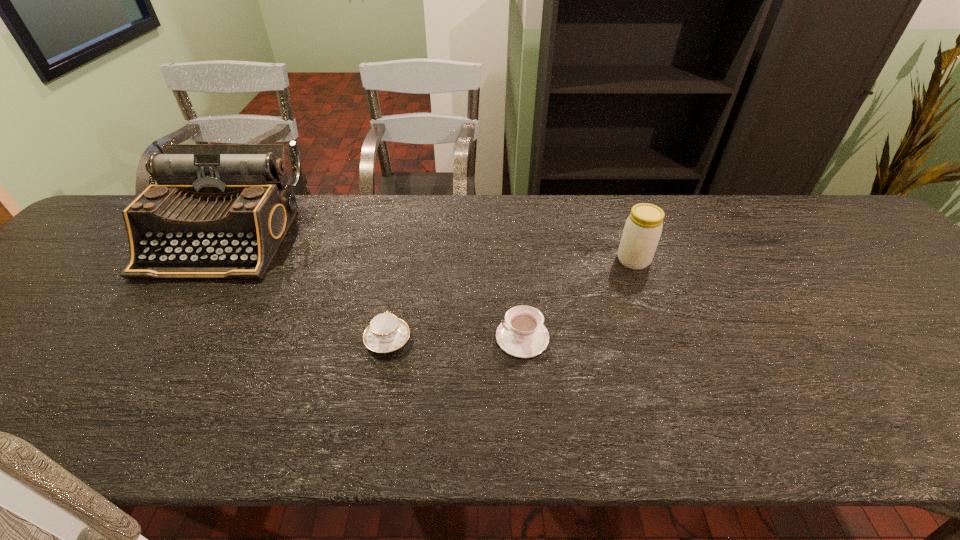
Locate an element on the screen. This screenshot has width=960, height=540. blank space that satisfies the following two spatial constraints: 1. on the keyboard of the typewriter; 2. on the left side of the second tallest object is located at coordinates (207, 260).

The image size is (960, 540). In order to click on free space that satisfies the following two spatial constraints: 1. on the side with the handle of the rightmost object; 2. on the right side of the second object from left to right in this screenshot , I will do `click(403, 260)`.